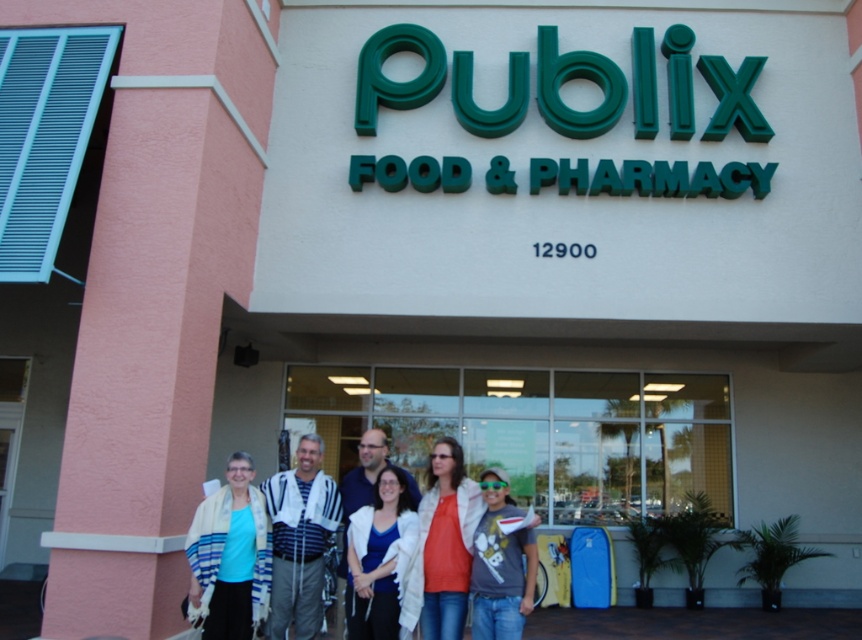
You are a photographer trying to capture a group photo of the people in front of the Publix store. You notice the matte orange shirt at center and the white textured shawl at center. Which item is shorter in height?

The matte orange shirt at center is shorter than the white textured shawl at center.